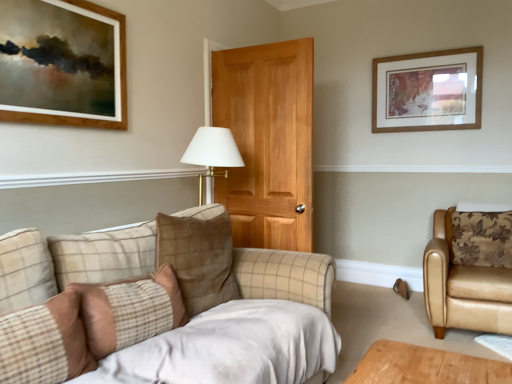
Question: Considering the positions of tan leather armchair at right and brown plaid pillow at lower left, marked as the 4th pillow in a back-to-front arrangement, in the image, is tan leather armchair at right wider or thinner than brown plaid pillow at lower left, marked as the 4th pillow in a back-to-front arrangement,?

Choices:
 (A) wide
 (B) thin

Answer: (A)

Question: Relative to brown plaid pillow at lower left, acting as the first pillow starting from the front, is tan leather armchair at right in front or behind?

Choices:
 (A) behind
 (B) front

Answer: (A)

Question: Which of these objects is positioned closest to the floral-patterned leather pillow at right, which appears as the first pillow when viewed from the back?

Choices:
 (A) plaid fabric pillow at lower left, marked as the second pillow in a front-to-back arrangement
 (B) tan leather armchair at right
 (C) brown checkered pillow at center, which is the 2th pillow in right-to-left order
 (D) wooden framed artwork at upper right
 (E) brown plaid pillow at lower left, acting as the first pillow starting from the front

Answer: (B)

Question: Which object is the farthest from the brown plaid pillow at lower left, the first pillow in the left-to-right sequence?

Choices:
 (A) brown checkered pillow at center, which is the 2th pillow in right-to-left order
 (B) floral-patterned leather pillow at right, which appears as the first pillow when viewed from the back
 (C) tan leather armchair at right
 (D) wooden framed artwork at upper right
 (E) plaid fabric pillow at lower left, placed as the 3th pillow when sorted from back to front

Answer: (D)